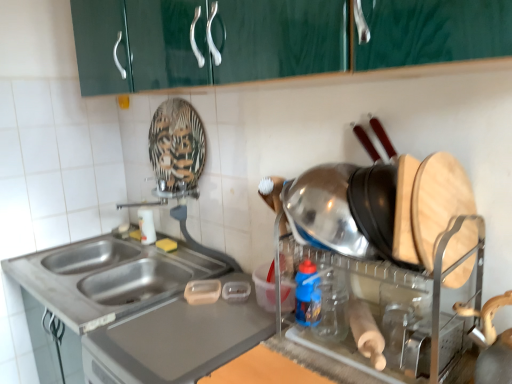
Question: Is stainless steel sink at lower left positioned before white glossy bottle at sink, which is counted as the 2th bottle, starting from the right?

Choices:
 (A) no
 (B) yes

Answer: (B)

Question: Considering the relative positions of stainless steel sink at lower left and white glossy bottle at sink, acting as the 1th bottle starting from the left, in the image provided, is stainless steel sink at lower left to the left of white glossy bottle at sink, acting as the 1th bottle starting from the left, from the viewer's perspective?

Choices:
 (A) no
 (B) yes

Answer: (B)

Question: Is stainless steel sink at lower left behind white glossy bottle at sink, which is counted as the 2th bottle, starting from the right?

Choices:
 (A) yes
 (B) no

Answer: (B)

Question: Is stainless steel sink at lower left not near white glossy bottle at sink, which appears as the first bottle when viewed from the back?

Choices:
 (A) yes
 (B) no

Answer: (B)

Question: Is stainless steel sink at lower left directly adjacent to white glossy bottle at sink, acting as the 1th bottle starting from the left?

Choices:
 (A) no
 (B) yes

Answer: (A)

Question: Can you confirm if stainless steel sink at lower left is thinner than white glossy bottle at sink, which is counted as the 2th bottle, starting from the right?

Choices:
 (A) no
 (B) yes

Answer: (A)

Question: Considering the relative sizes of white glossy bottle at sink, acting as the 1th bottle starting from the left, and shiny metallic pot at right in the image provided, is white glossy bottle at sink, acting as the 1th bottle starting from the left, shorter than shiny metallic pot at right?

Choices:
 (A) no
 (B) yes

Answer: (B)

Question: From the image's perspective, is white glossy bottle at sink, acting as the 1th bottle starting from the left, on top of shiny metallic pot at right?

Choices:
 (A) no
 (B) yes

Answer: (B)

Question: Is white glossy bottle at sink, acting as the 1th bottle starting from the left, in contact with shiny metallic pot at right?

Choices:
 (A) yes
 (B) no

Answer: (B)

Question: From a real-world perspective, is white glossy bottle at sink, which appears as the first bottle when viewed from the back, on top of shiny metallic pot at right?

Choices:
 (A) yes
 (B) no

Answer: (B)

Question: Is the position of white glossy bottle at sink, acting as the 1th bottle starting from the left, less distant than that of shiny metallic pot at right?

Choices:
 (A) no
 (B) yes

Answer: (A)

Question: Can you confirm if white glossy bottle at sink, which is counted as the 2th bottle, starting from the right, is wider than shiny metallic pot at right?

Choices:
 (A) yes
 (B) no

Answer: (B)

Question: Is blue plastic bottle at center, placed as the first bottle when sorted from right to left, surrounded by shiny metallic pot at right?

Choices:
 (A) no
 (B) yes

Answer: (B)